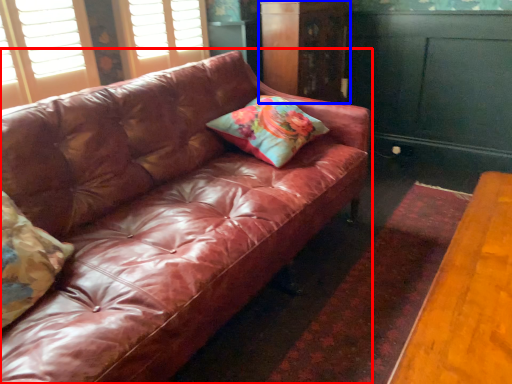
Question: Among these objects, which one is farthest to the camera, studio couch (highlighted by a red box) or dresser (highlighted by a blue box)?

Choices:
 (A) studio couch
 (B) dresser

Answer: (B)